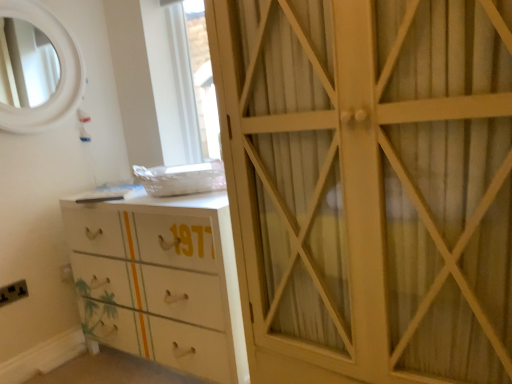
Question: Does point (131, 279) appear closer or farther from the camera than point (404, 362)?

Choices:
 (A) closer
 (B) farther

Answer: (B)

Question: From the image's perspective, is white glossy chest of drawers at lower left above or below white wood cabinet at right?

Choices:
 (A) below
 (B) above

Answer: (A)

Question: Which object is positioned closest to the white wood cabinet at right?

Choices:
 (A) white glossy chest of drawers at lower left
 (B) black plastic electric outlet at lower left

Answer: (A)

Question: Which is nearer to the white wood cabinet at right?

Choices:
 (A) black plastic electric outlet at lower left
 (B) white glossy chest of drawers at lower left

Answer: (B)